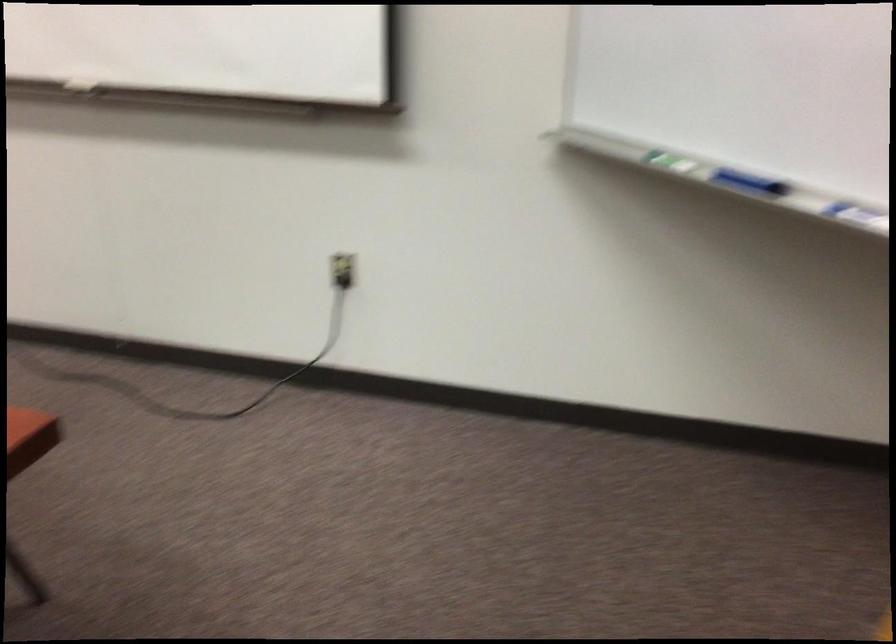
Where is `chair sitting surface`? Image resolution: width=896 pixels, height=644 pixels. chair sitting surface is located at coordinates (29, 437).